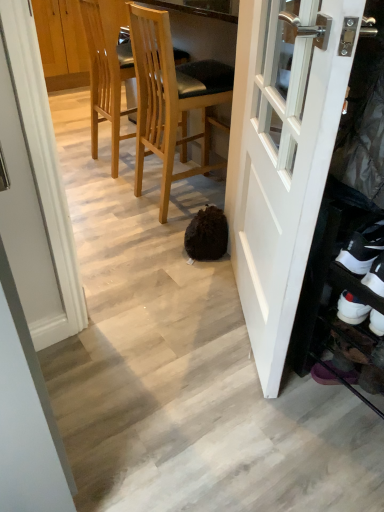
Where is `vacant region in front of light brown wood chair at center, which is counted as the 1th chair, starting from the right`? The image size is (384, 512). vacant region in front of light brown wood chair at center, which is counted as the 1th chair, starting from the right is located at coordinates point(145,233).